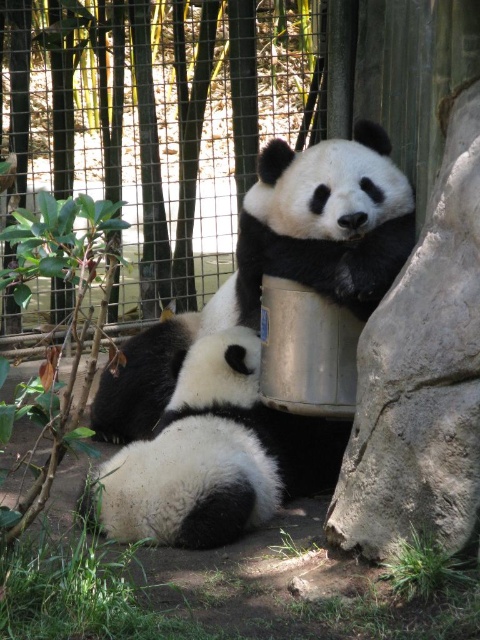
You are a zookeeper who needs to ensure the safety of the pandas. The enclosure has a brushed metal fence at upper center and a white soft fur panda at center. Based on their heights, which one is taller?

The brushed metal fence at upper center is taller than the white soft fur panda at center.

You are a zookeeper who needs to place a new feeding tray between the gray rough stone at right and the black fuzzy panda at center. The tray requires 28 inches of space. Can you fit it between them?

The distance between the gray rough stone at right and the black fuzzy panda at center is 24.50 inches, which is less than the required 28 inches. Therefore, the feeding tray cannot be placed between them.

You are a zookeeper trying to place a new feeding tray between the gray rough stone at right and the black fuzzy panda at center. Given that the feeding tray requires 1.2 meters of space, can you fit it between them?

The gray rough stone at right has a lesser width compared to the black fuzzy panda at center. However, the description does not provide the exact distance between them, so it is impossible to determine if the feeding tray will fit.